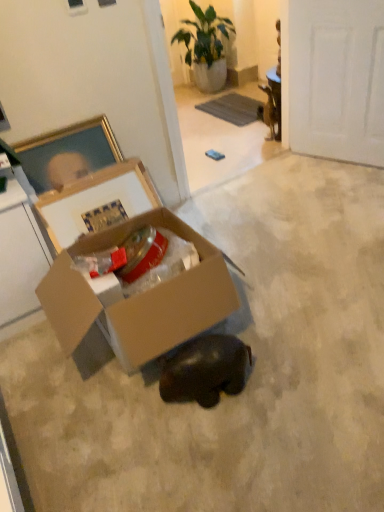
Identify the location of vacant space to the left of white matte door at upper right. (296, 174).